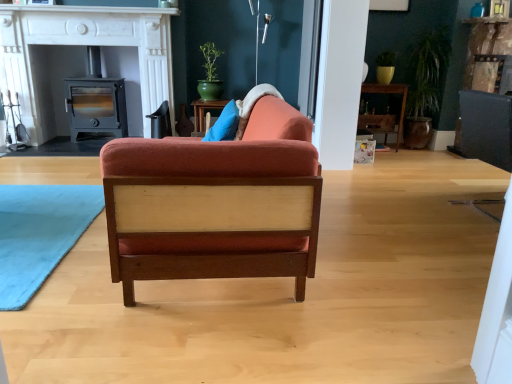
Question: Can you confirm if matte black wood-burning stove at left is positioned to the right of velvet orange chair at center?

Choices:
 (A) no
 (B) yes

Answer: (A)

Question: Considering the relative sizes of matte black wood-burning stove at left and velvet orange chair at center in the image provided, is matte black wood-burning stove at left shorter than velvet orange chair at center?

Choices:
 (A) no
 (B) yes

Answer: (A)

Question: Is matte black wood-burning stove at left in contact with velvet orange chair at center?

Choices:
 (A) yes
 (B) no

Answer: (B)

Question: Is velvet orange chair at center at the back of matte black wood-burning stove at left?

Choices:
 (A) yes
 (B) no

Answer: (B)

Question: From a real-world perspective, is matte black wood-burning stove at left over velvet orange chair at center?

Choices:
 (A) yes
 (B) no

Answer: (A)

Question: From a real-world perspective, is matte black wood-burning stove at left under velvet orange chair at center?

Choices:
 (A) no
 (B) yes

Answer: (A)

Question: From a real-world perspective, is matte black wood-burning stove at left on top of green glazed pot at upper center?

Choices:
 (A) yes
 (B) no

Answer: (B)

Question: Would you consider matte black wood-burning stove at left to be distant from green glazed pot at upper center?

Choices:
 (A) no
 (B) yes

Answer: (B)

Question: Can you confirm if matte black wood-burning stove at left is smaller than green glazed pot at upper center?

Choices:
 (A) no
 (B) yes

Answer: (A)

Question: Can you confirm if matte black wood-burning stove at left is wider than green glazed pot at upper center?

Choices:
 (A) yes
 (B) no

Answer: (A)

Question: From a real-world perspective, is matte black wood-burning stove at left below green glazed pot at upper center?

Choices:
 (A) yes
 (B) no

Answer: (A)

Question: Considering the relative sizes of matte black wood-burning stove at left and green glazed pot at upper center in the image provided, is matte black wood-burning stove at left bigger than green glazed pot at upper center?

Choices:
 (A) no
 (B) yes

Answer: (B)

Question: Is wooden shelf at center thinner than matte black wood stove at left?

Choices:
 (A) yes
 (B) no

Answer: (A)